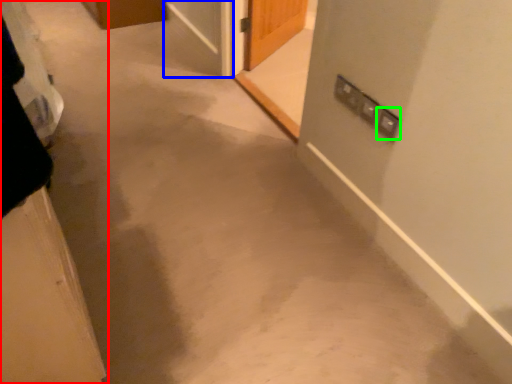
Question: Which object is positioned farthest from door (highlighted by a red box)? Select from screen door (highlighted by a blue box) and electric outlet (highlighted by a green box).

Choices:
 (A) screen door
 (B) electric outlet

Answer: (A)